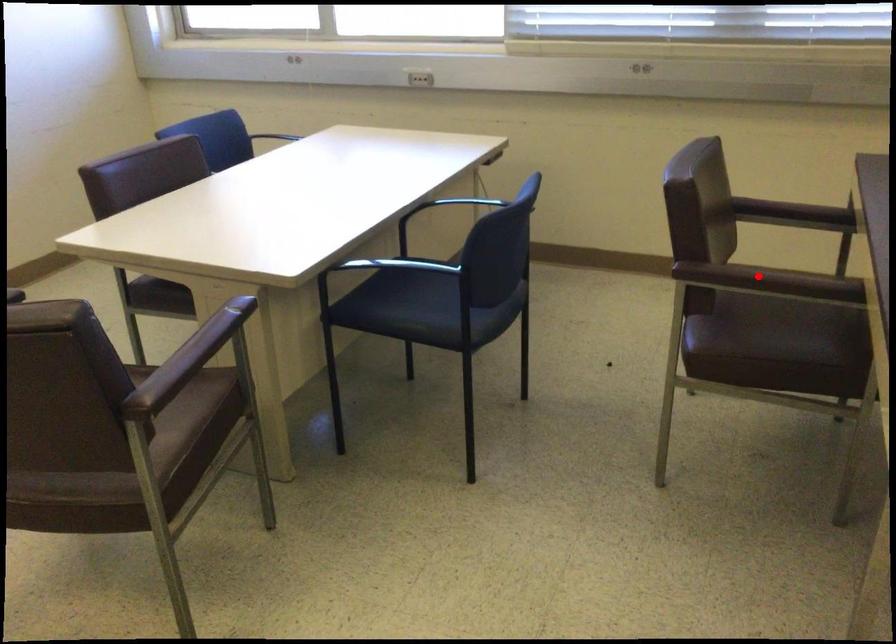
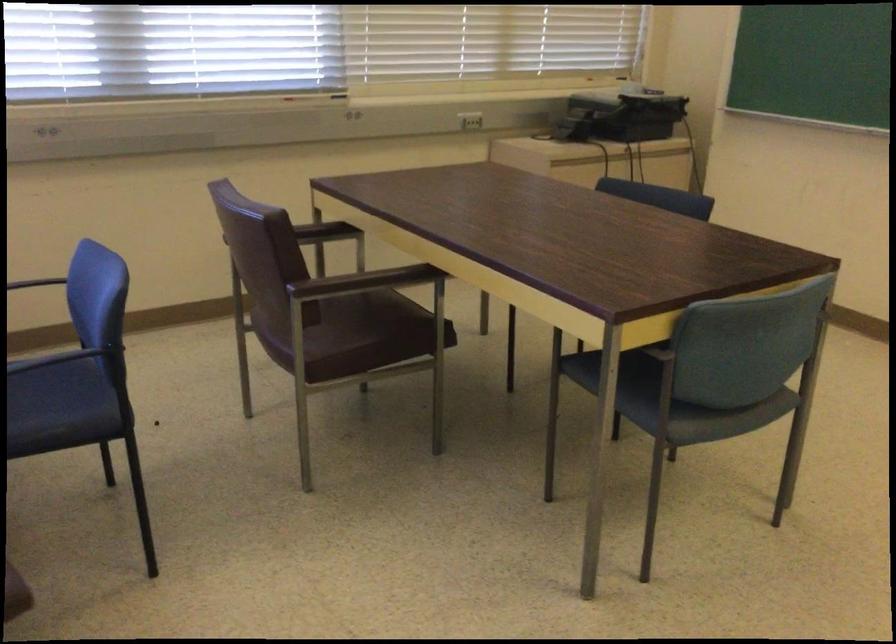
The point at the highlighted location is marked in the first image. Where is the corresponding point in the second image?

(362, 281)